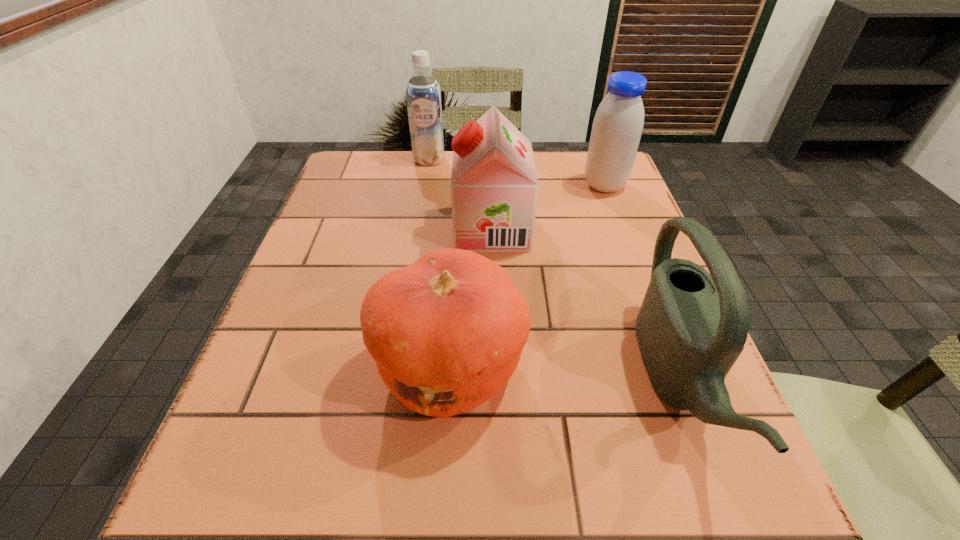
This screenshot has height=540, width=960. In order to click on the farthest soya milk in this screenshot , I will do `click(423, 95)`.

Find the location of a particular element. Image resolution: width=960 pixels, height=540 pixels. the farthest object is located at coordinates (423, 95).

The image size is (960, 540). Find the location of `the rightmost soya milk`. the rightmost soya milk is located at coordinates (618, 123).

Where is `the second farthest object`? This screenshot has width=960, height=540. the second farthest object is located at coordinates (618, 123).

Locate an element on the screen. the nearest soya milk is located at coordinates (494, 186).

Locate an element on the screen. the second soya milk from right to left is located at coordinates (494, 186).

The image size is (960, 540). I want to click on watering can, so click(692, 326).

Locate an element on the screen. pumpkin is located at coordinates (446, 332).

Where is `free point located 0.060m on the label of the farthest object`? The width and height of the screenshot is (960, 540). free point located 0.060m on the label of the farthest object is located at coordinates (426, 179).

Image resolution: width=960 pixels, height=540 pixels. Identify the location of vacant space located 0.360m on the left of the second farthest object. (444, 185).